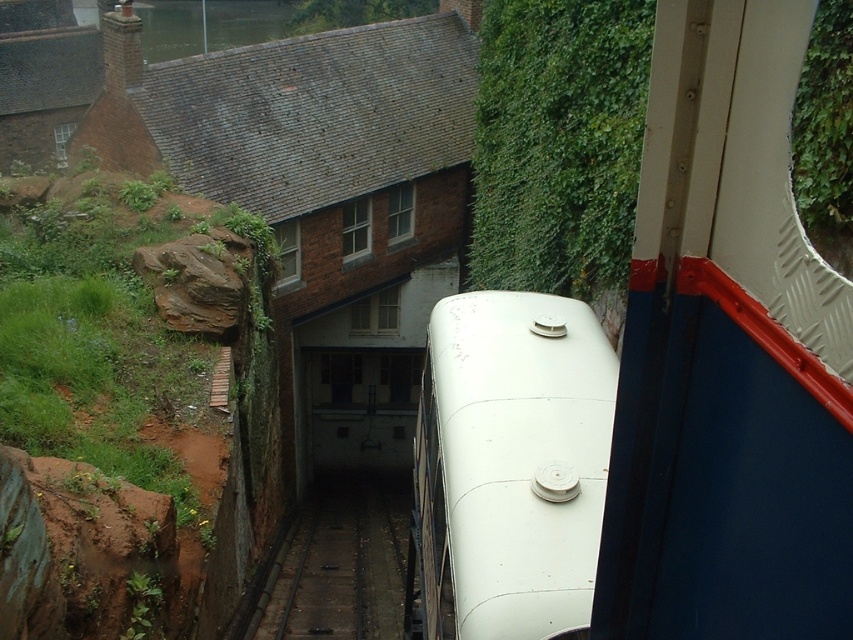
Question: Which of the following is the closest to the observer?

Choices:
 (A) green leafy wall at upper center
 (B) dark gray metal train track at center

Answer: (A)

Question: Is white matte train at center to the right of dark gray metal train track at center from the viewer's perspective?

Choices:
 (A) yes
 (B) no

Answer: (A)

Question: Which point is farther to the camera?

Choices:
 (A) green leafy wall at upper center
 (B) dark gray metal train track at center
 (C) white matte train at center

Answer: (B)

Question: Is white matte train at center smaller than green leafy wall at upper center?

Choices:
 (A) yes
 (B) no

Answer: (A)

Question: Can you confirm if green leafy wall at upper center is positioned to the left of dark gray metal train track at center?

Choices:
 (A) yes
 (B) no

Answer: (B)

Question: Which object is positioned closest to the green leafy wall at upper center?

Choices:
 (A) dark gray metal train track at center
 (B) white matte train at center

Answer: (A)